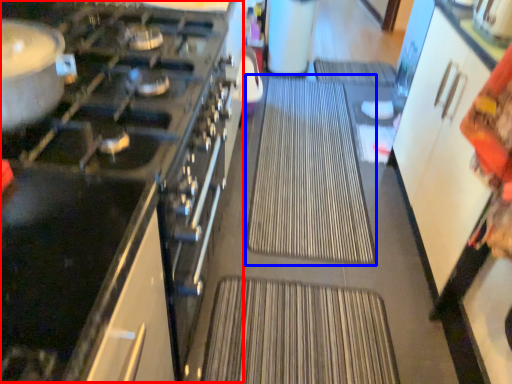
Question: Which object is closer to the camera taking this photo, appliance (highlighted by a red box) or wide (highlighted by a blue box)?

Choices:
 (A) appliance
 (B) wide

Answer: (A)